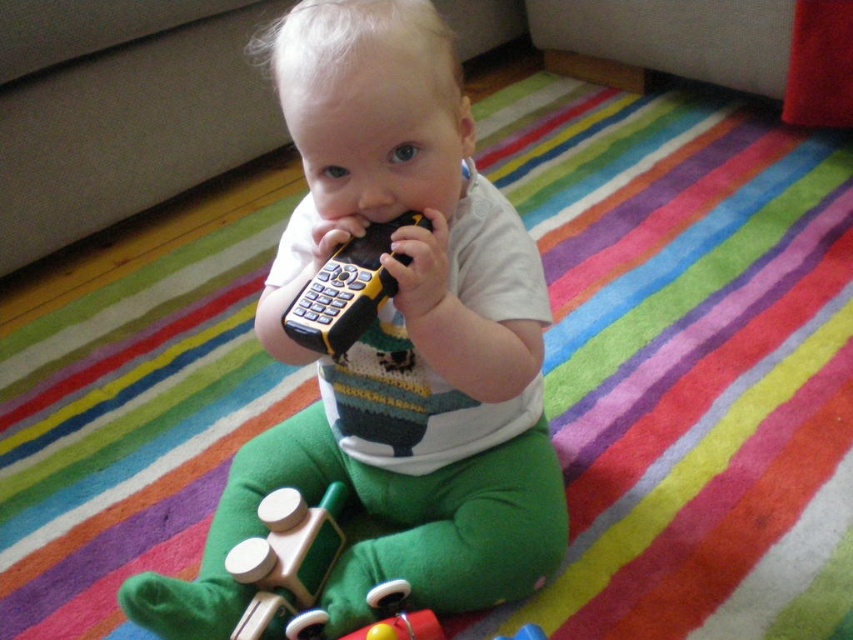
You are a child who wants to pick up the yellow plastic remote at center but there is a wooden train at lower center in the way. Can you reach the remote without moving the train?

The yellow plastic remote at center is behind wooden train at lower center, so you can reach it without moving the train because it is positioned behind the train.

Looking at this image, you are a parent who wants to place a small toy measuring 3 inches in length between the wooden toy car at center and the wooden train at lower center. Is there enough space between them to fit the toy?

The wooden toy car at center and wooden train at lower center are 7.84 inches apart from each other. Since the small toy is 3 inches long, there is sufficient space between them to fit the toy.